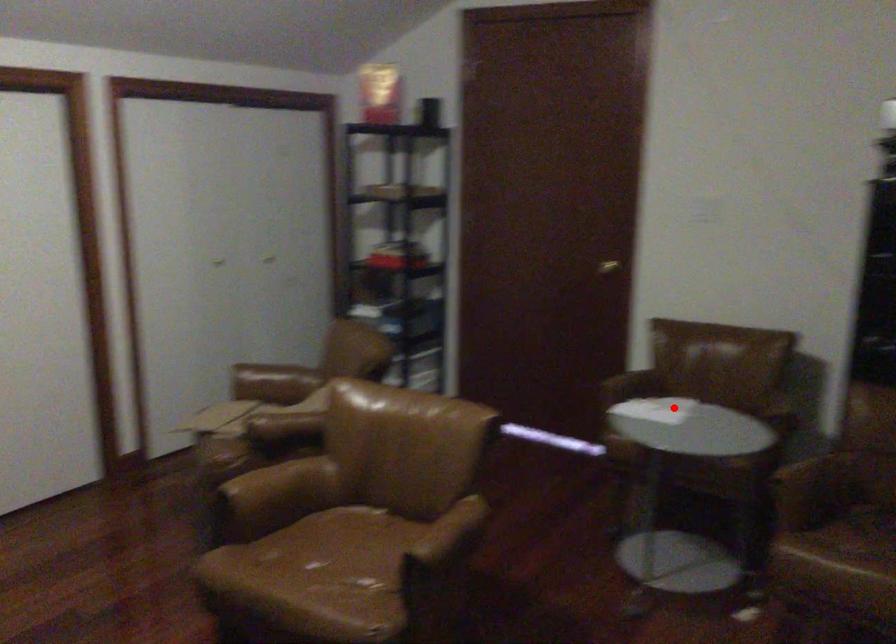
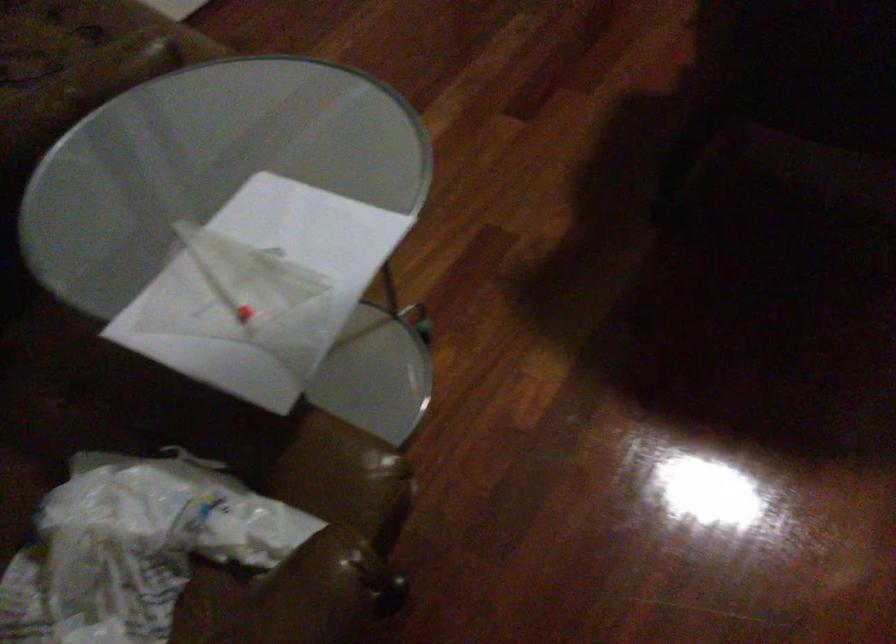
Locate, in the second image, the point that corresponds to the highlighted location in the first image.

(134, 547)